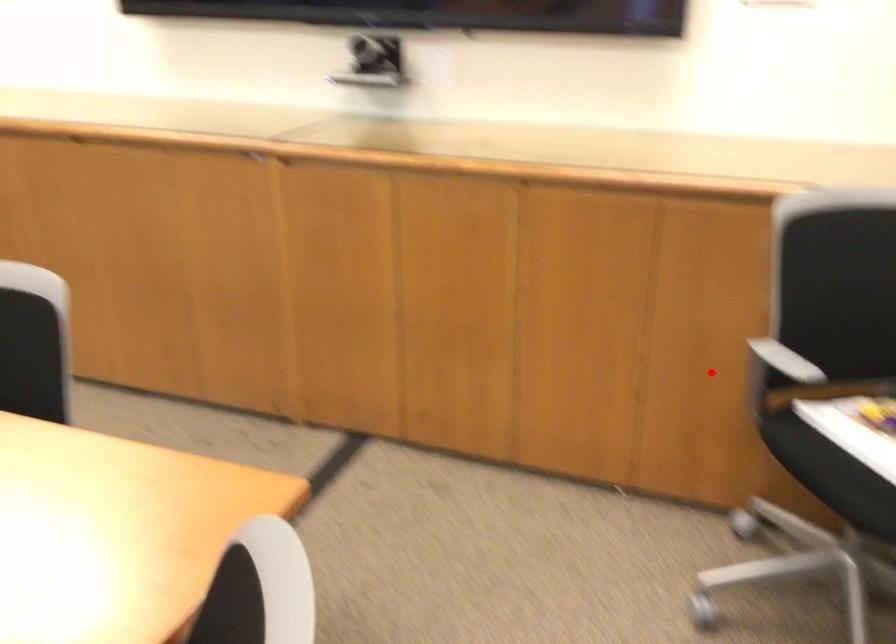
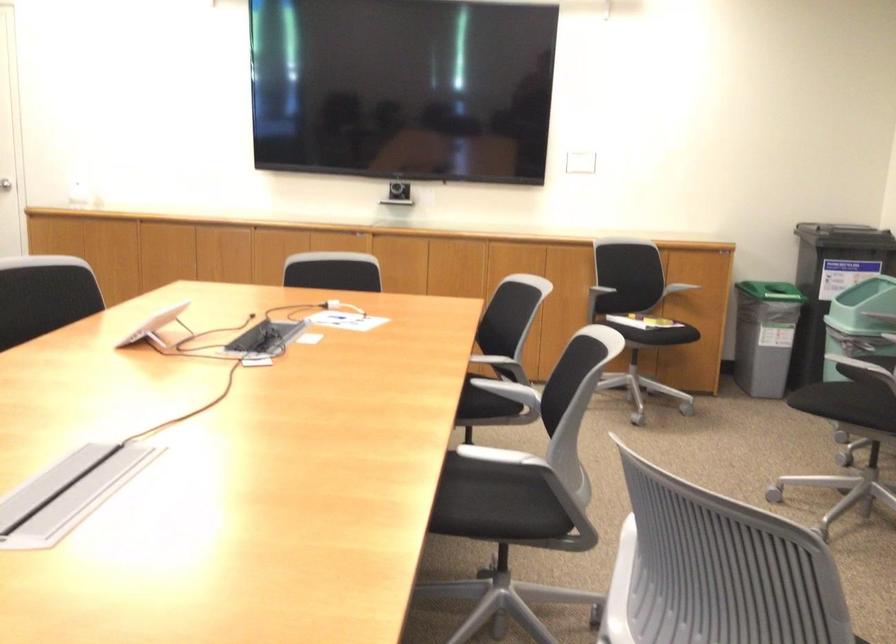
Question: A red point is marked in image1. In image2, is the corresponding 3D point closer to the camera or farther? Reply with the corresponding letter.

Choices:
 (A) The corresponding 3D point is closer.
 (B) The corresponding 3D point is farther.

Answer: (B)